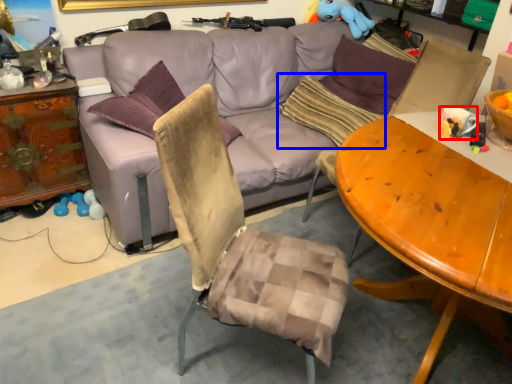
Question: Among these objects, which one is nearest to the camera, coffee cup (highlighted by a red box) or pillow (highlighted by a blue box)?

Choices:
 (A) coffee cup
 (B) pillow

Answer: (A)